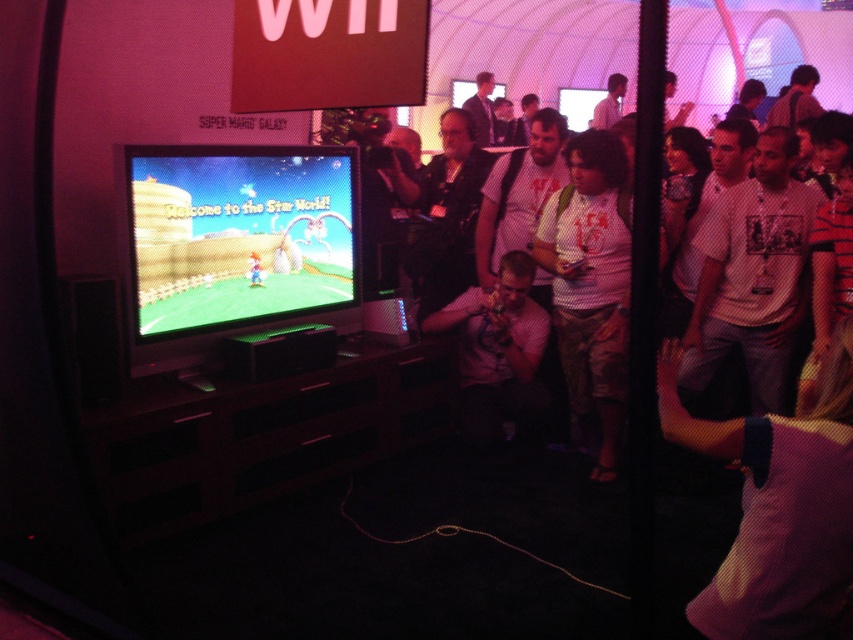
You are a game tester who needs to reach both the purple mesh shirt at center and the white dotted shirt at center to check for any game glitches. If your arm can only reach 5 feet, can you touch both shirts without moving your position?

The purple mesh shirt at center is 5.35 feet from the white dotted shirt at center. Since your arm can only reach 5 feet, you cannot touch both shirts at the same time without moving your position.